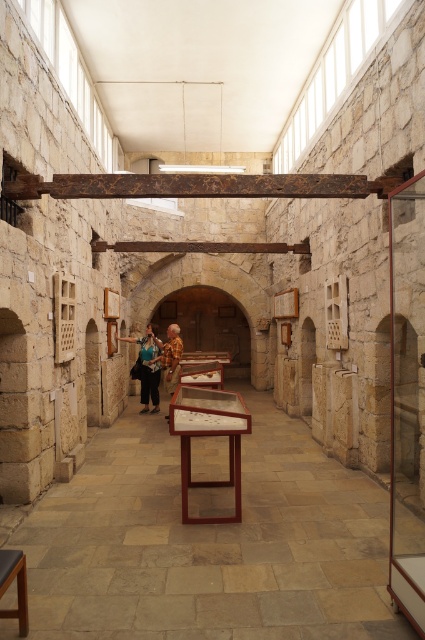
Is point (130, 339) closer to viewer compared to point (167, 392)?

That is True.

Is blue denim jeans at center smaller than golden textured statue at center?

Yes, blue denim jeans at center is smaller than golden textured statue at center.

Is point (153, 340) farther from viewer compared to point (163, 364)?

No, (153, 340) is closer to viewer.

At what (x,y) coordinates should I click in order to perform the action: click on blue denim jeans at center. Please return your answer as a coordinate pair (x, y). The image size is (425, 640). Looking at the image, I should click on (149, 365).

Does blue denim jeans at center appear on the right side of smooth wooden stool at lower left?

Incorrect, blue denim jeans at center is not on the right side of smooth wooden stool at lower left.

Between point (144, 344) and point (19, 602), which one is positioned behind?

Positioned behind is point (144, 344).

What are the coordinates of `blue denim jeans at center` in the screenshot? It's located at tap(149, 365).

Is wooden display case at center below blue denim jeans at center?

Indeed, wooden display case at center is positioned under blue denim jeans at center.

Between wooden display case at center and blue denim jeans at center, which one is positioned lower?

Positioned lower is wooden display case at center.

What do you see at coordinates (209, 544) in the screenshot? The height and width of the screenshot is (640, 425). I see `wooden display case at center` at bounding box center [209, 544].

Where is `wooden display case at center`? The image size is (425, 640). wooden display case at center is located at coordinates (209, 544).